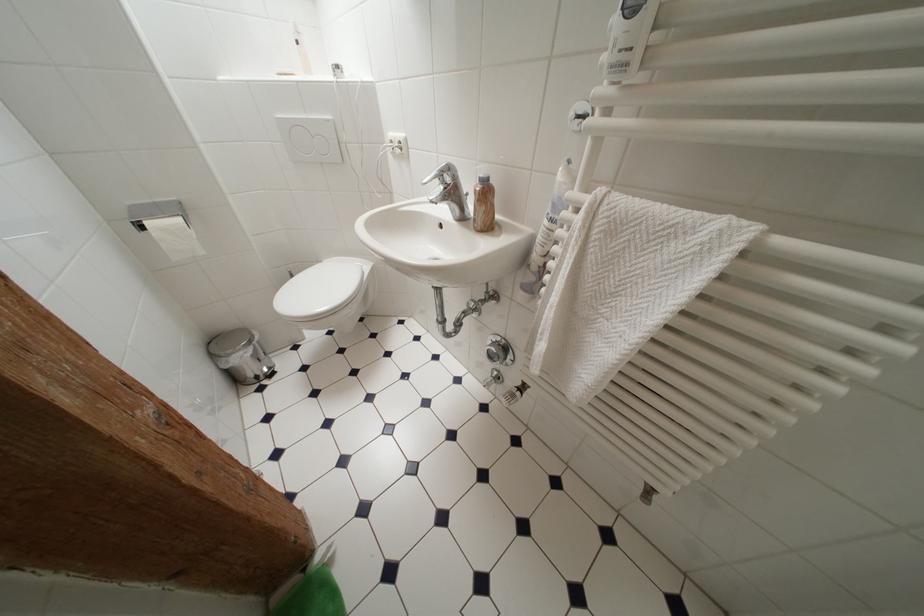
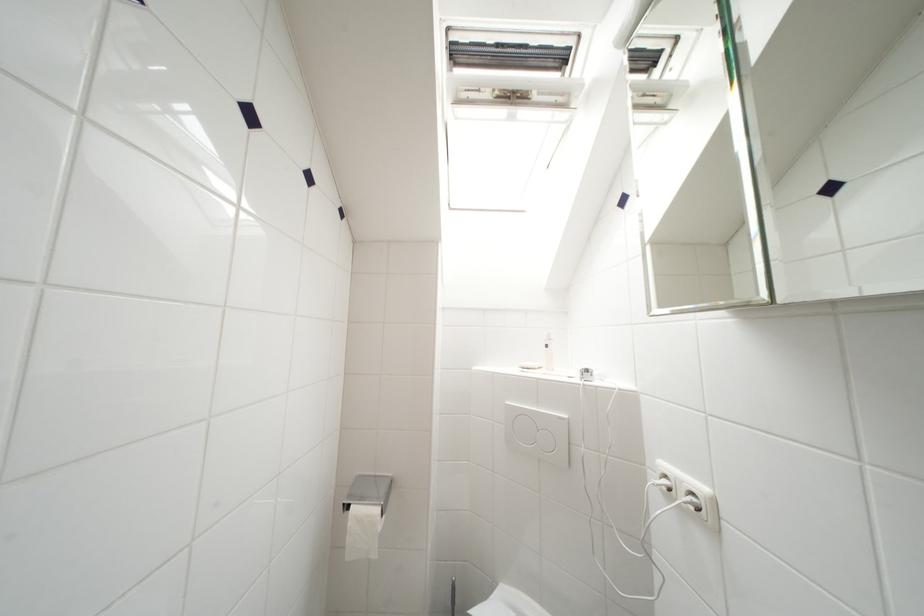
Where in the second image is the point corresponding to pixel 333 124 from the first image?

(565, 421)